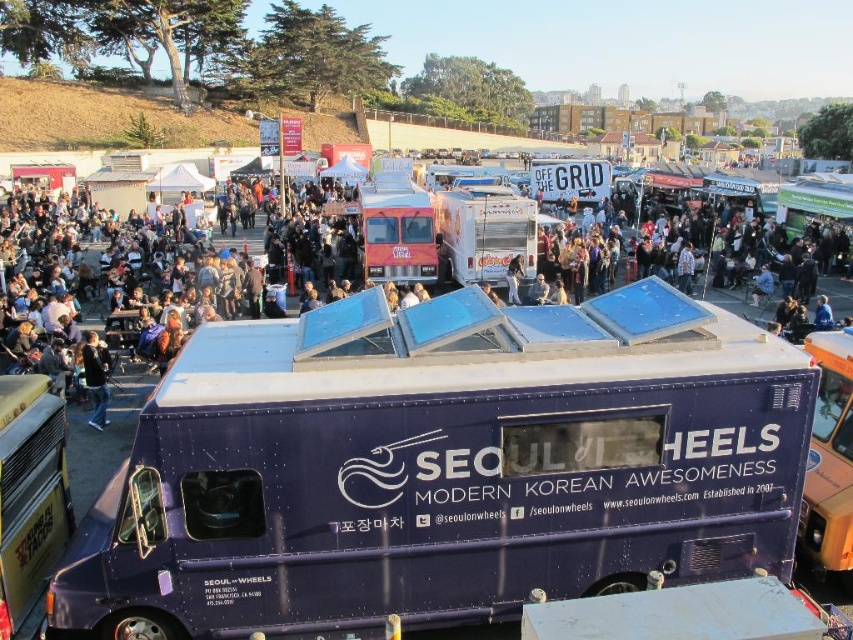
You are at the food truck event and want to choose between the metallic purple food truck at center and the silver metallic food truck at center. Which one is the bigger truck?

The silver metallic food truck at center is bigger than the metallic purple food truck at center.